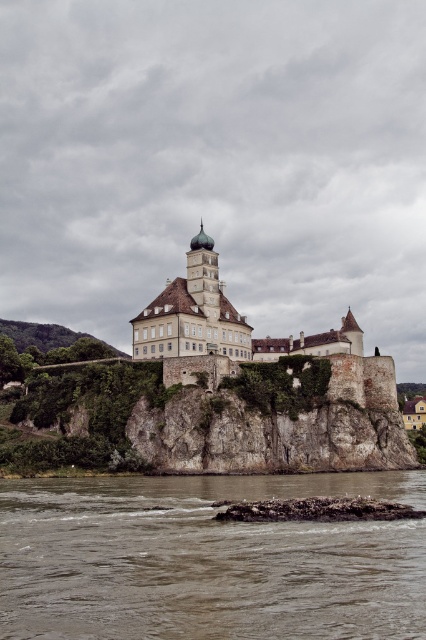
Can you confirm if brown sedimentary rock at lower center is positioned below white stone castle at center?

Correct, brown sedimentary rock at lower center is located below white stone castle at center.

Does point (187, 602) come farther from viewer compared to point (172, 298)?

No, (187, 602) is in front of (172, 298).

Is point (92, 483) positioned before point (157, 312)?

Yes, point (92, 483) is closer to viewer.

Find the location of `brown sedimentary rock at lower center`. brown sedimentary rock at lower center is located at coordinates (207, 561).